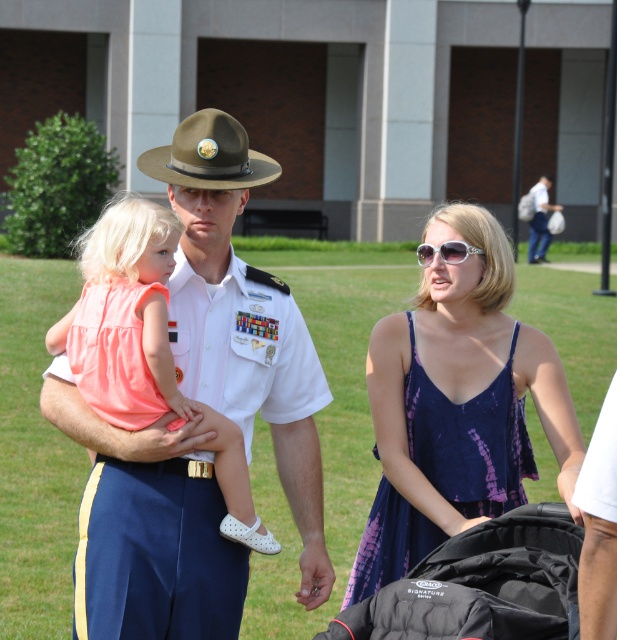
Who is more distant from viewer, (x=532, y=515) or (x=539, y=216)?

The point (x=539, y=216) is behind.

Between point (462, 554) and point (539, 188), which one is positioned in front?

Point (462, 554)

What do you see at coordinates (481, 584) in the screenshot? Image resolution: width=617 pixels, height=640 pixels. I see `black fabric baby carriage at lower center` at bounding box center [481, 584].

You are a GUI agent. You are given a task and a screenshot of the screen. Output one action in this format:
    pyautogui.click(x=<x>, y=<y>)
    Task: Click on the black fabric baby carriage at lower center
    Image resolution: width=617 pixels, height=640 pixels.
    Given the screenshot: What is the action you would take?
    pyautogui.click(x=481, y=584)

Between black fabric baby carriage at lower center and purple tie-dye dress at center, which one has more height?

Standing taller between the two is purple tie-dye dress at center.

Who is more forward, (379, 600) or (471, 474)?

Point (379, 600) is in front.

You are a GUI agent. You are given a task and a screenshot of the screen. Output one action in this format:
    pyautogui.click(x=<x>, y=<y>)
    Task: Click on the black fabric baby carriage at lower center
    The width and height of the screenshot is (617, 640).
    Given the screenshot: What is the action you would take?
    pyautogui.click(x=481, y=584)

Does purple tie-dye dress at center have a larger size compared to white cotton shirt at upper right?

Yes.

Which is in front, point (507, 433) or point (544, 220)?

Point (507, 433)

The height and width of the screenshot is (640, 617). Identify the location of purple tie-dye dress at center. (468, 438).